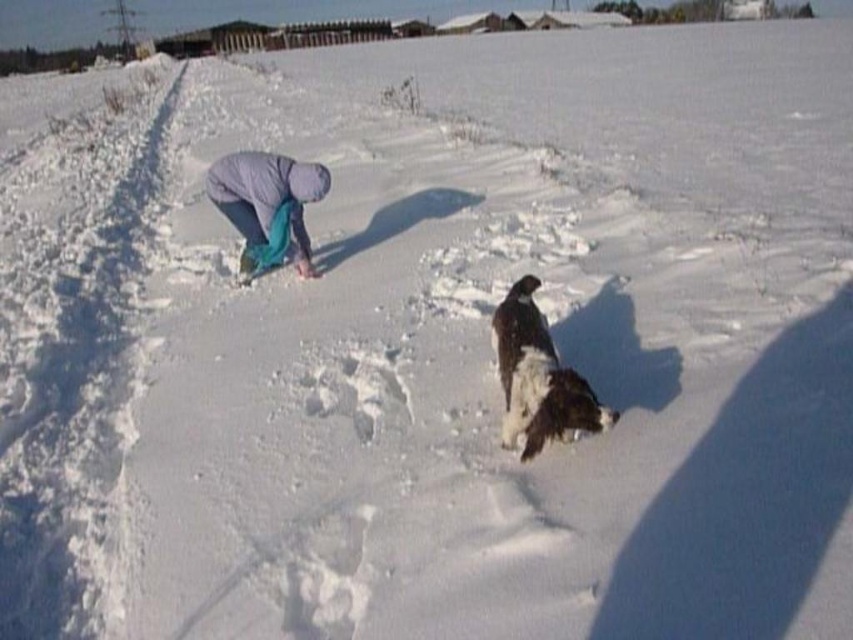
You are standing in the snowy landscape and want to know if the white fluffy dog at center can see over the light purple fabric at center. Based on their heights, can it?

The white fluffy dog at center is shorter than the light purple fabric at center, so it cannot see over the light purple fabric at center.

You are standing at the center of the snowy landscape and see the white fluffy dog at center. Where is the white fluffy dog relative to your position?

The white fluffy dog at center is located at point 0.591 on the x axis and 0.632 on the y axis relative to the center of the image.